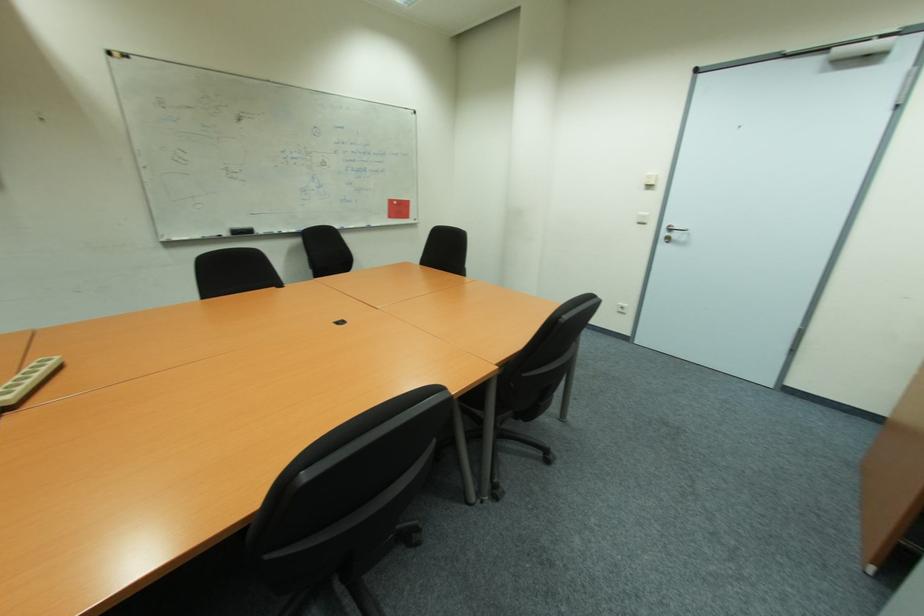
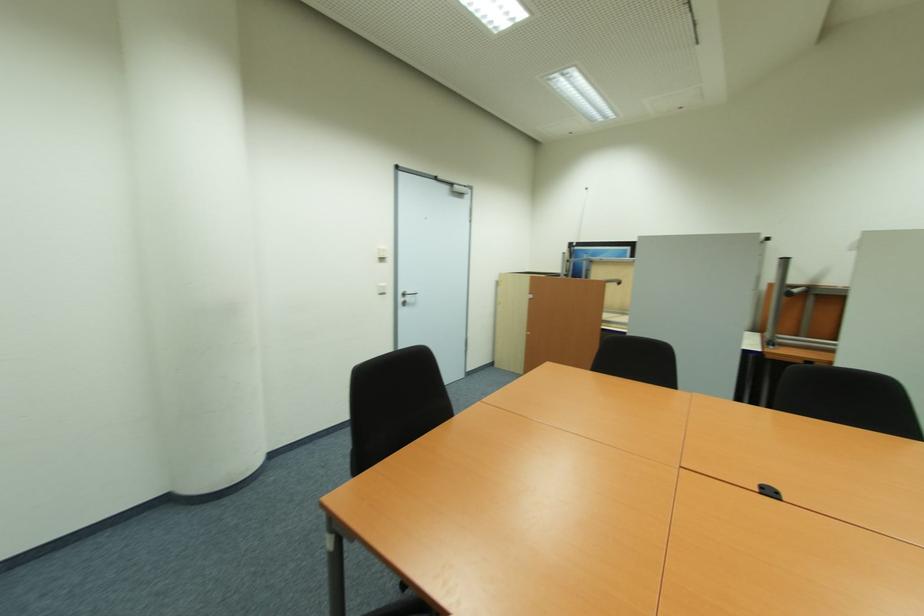
Find the pixel in the second image that matches (x=666, y=235) in the first image.

(405, 300)